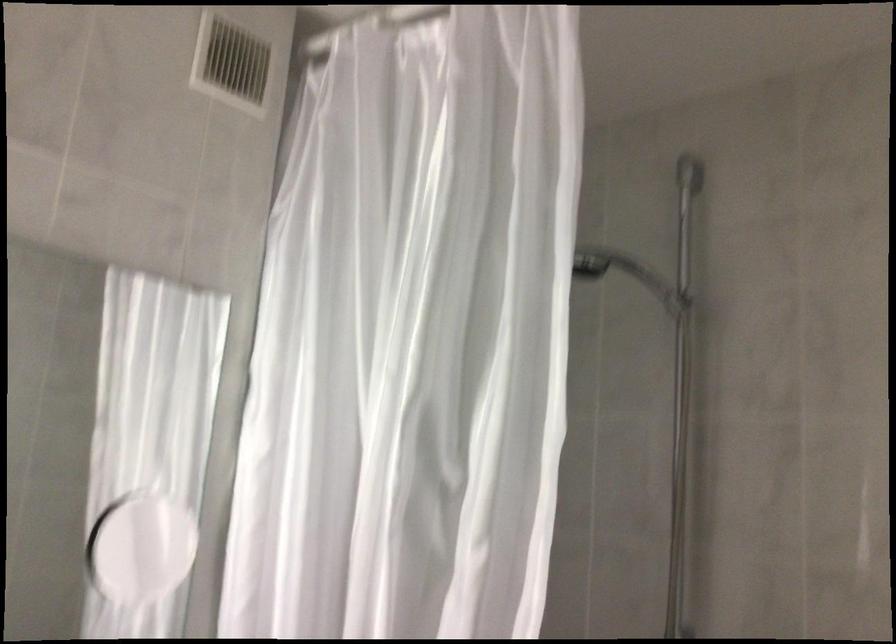
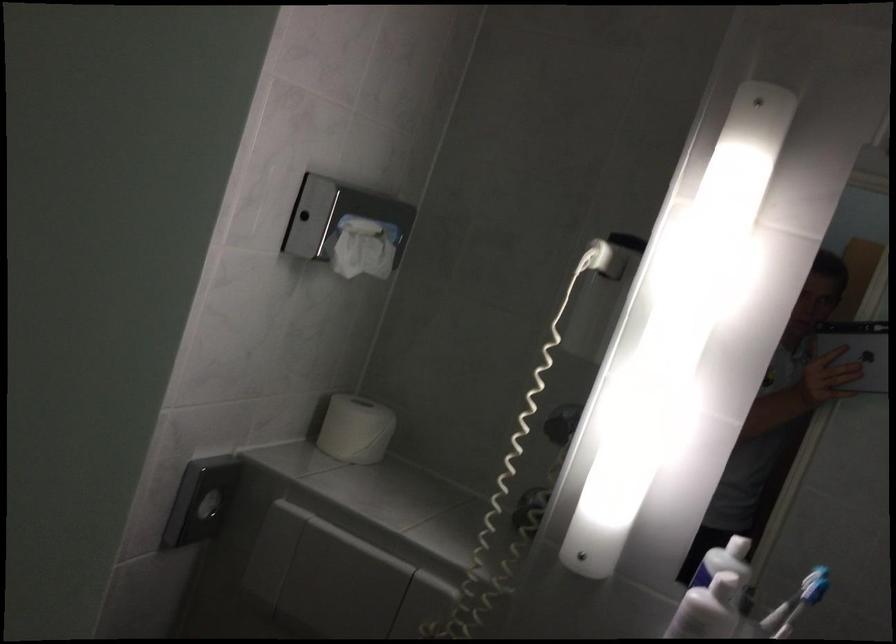
Question: The camera is either moving clockwise (left) or counter-clockwise (right) around the object. The first image is from the beginning of the video and the second image is from the end. Is the camera moving left or right when shooting the video?

Choices:
 (A) Left
 (B) Right

Answer: (B)